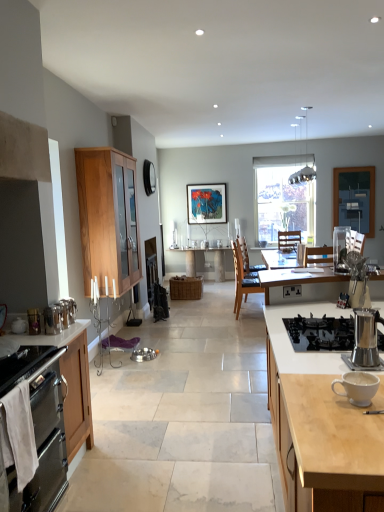
Question: Considering the relative positions of clear glass window at center and metallic silver kettle at left, which appears as the sixth appliance when viewed from the right, in the image provided, is clear glass window at center to the left or to the right of metallic silver kettle at left, which appears as the sixth appliance when viewed from the right,?

Choices:
 (A) left
 (B) right

Answer: (B)

Question: Looking at the image, does clear glass window at center seem bigger or smaller compared to metallic silver kettle at left, which is counted as the third appliance, starting from the front?

Choices:
 (A) big
 (B) small

Answer: (A)

Question: Which object is the closest to the stainless steel oven at lower left, which is the second cabinetry in front-to-back order?

Choices:
 (A) matte wooden picture frame at center
 (B) brown leather chair at center
 (C) satin silver coffee maker at center-right, which appears as the 1th appliance when viewed from the right
 (D) light wood countertop at right, the 3th cabinetry positioned from the left
 (E) wooden table at center

Answer: (D)

Question: Which object is positioned farthest from the stainless steel oven at lower left, the 3th cabinetry viewed from the right?

Choices:
 (A) wooden table at center
 (B) light wood/glass cabinet at left, the 2th cabinetry in the right-to-left sequence
 (C) brown leather chair at center
 (D) white ceramic mug at right
 (E) satin silver coffee maker at center-right, the 6th appliance when ordered from left to right

Answer: (E)